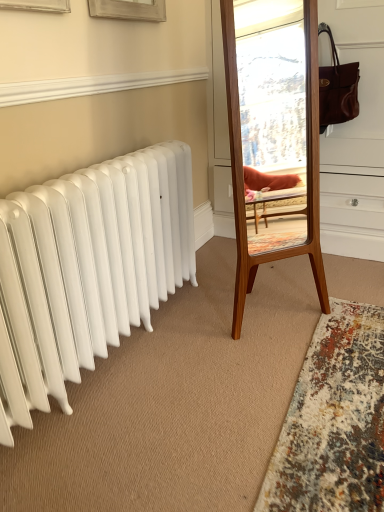
This screenshot has height=512, width=384. What do you see at coordinates (333, 420) in the screenshot?
I see `multicolored shaggy rug at lower right` at bounding box center [333, 420].

The height and width of the screenshot is (512, 384). I want to click on wooden mirror at center, so click(242, 168).

Is multicolored shaggy rug at lower right inside white smooth baseboard at upper center?

That's incorrect, multicolored shaggy rug at lower right is not inside white smooth baseboard at upper center.

Between white smooth baseboard at upper center and multicolored shaggy rug at lower right, which one has larger width?

multicolored shaggy rug at lower right.

Is white smooth baseboard at upper center turned away from multicolored shaggy rug at lower right?

white smooth baseboard at upper center is not turned away from multicolored shaggy rug at lower right.

Which object is further away from the camera, white smooth baseboard at upper center or multicolored shaggy rug at lower right?

white smooth baseboard at upper center.

Is wooden mirror at center closer to camera compared to white smooth baseboard at upper center?

No, wooden mirror at center is further to the viewer.

Which object is thinner, wooden mirror at center or white smooth baseboard at upper center?

With smaller width is white smooth baseboard at upper center.

Is wooden mirror at center touching white smooth baseboard at upper center?

No.

Could white smooth baseboard at upper center be considered to be inside wooden mirror at center?

No, white smooth baseboard at upper center is not inside wooden mirror at center.

Does multicolored shaggy rug at lower right have a greater height compared to wooden mirror at center?

In fact, multicolored shaggy rug at lower right may be shorter than wooden mirror at center.

From the image's perspective, is multicolored shaggy rug at lower right above wooden mirror at center?

No, from the image's perspective, multicolored shaggy rug at lower right is not above wooden mirror at center.

Is multicolored shaggy rug at lower right positioned far away from wooden mirror at center?

multicolored shaggy rug at lower right is actually quite close to wooden mirror at center.

Considering the relative sizes of multicolored shaggy rug at lower right and wooden mirror at center in the image provided, is multicolored shaggy rug at lower right smaller than wooden mirror at center?

Indeed, multicolored shaggy rug at lower right has a smaller size compared to wooden mirror at center.

In the image, is wooden mirror at center positioned in front of or behind multicolored shaggy rug at lower right?

wooden mirror at center is positioned farther from the viewer than multicolored shaggy rug at lower right.

Considering the points (225, 66) and (310, 485), which point is behind, point (225, 66) or point (310, 485)?

Positioned behind is point (225, 66).

Looking at this image, between multicolored shaggy rug at lower right and white smooth baseboard at upper center, which one is positioned behind?

white smooth baseboard at upper center is further away from the camera.

Could you tell me if multicolored shaggy rug at lower right is turned towards white smooth baseboard at upper center?

No, multicolored shaggy rug at lower right is not turned towards white smooth baseboard at upper center.

Would you say multicolored shaggy rug at lower right contains white smooth baseboard at upper center?

Actually, white smooth baseboard at upper center is outside multicolored shaggy rug at lower right.

Would you say multicolored shaggy rug at lower right is to the left or to the right of white smooth baseboard at upper center in the picture?

Based on their positions, multicolored shaggy rug at lower right is located to the right of white smooth baseboard at upper center.

Is white smooth baseboard at upper center positioned far away from wooden mirror at center?

Actually, white smooth baseboard at upper center and wooden mirror at center are a little close together.

Based on the photo, can you confirm if white smooth baseboard at upper center is smaller than wooden mirror at center?

Indeed, white smooth baseboard at upper center has a smaller size compared to wooden mirror at center.

In the scene shown: From the image's perspective, is white smooth baseboard at upper center below wooden mirror at center?

Incorrect, from the image's perspective, white smooth baseboard at upper center is higher than wooden mirror at center.

Which of these two, white smooth baseboard at upper center or wooden mirror at center, stands taller?

Standing taller between the two is wooden mirror at center.

In order to click on window sill located above the multicolored shaggy rug at lower right (from a real-world perspective) in this screenshot , I will do `click(92, 85)`.

The height and width of the screenshot is (512, 384). I want to click on window sill that is on the left side of wooden mirror at center, so click(x=92, y=85).

Based on their spatial positions, is multicolored shaggy rug at lower right or wooden mirror at center further from white smooth baseboard at upper center?

Based on the image, multicolored shaggy rug at lower right appears to be further to white smooth baseboard at upper center.

Which object lies nearer to the anchor point multicolored shaggy rug at lower right, wooden mirror at center or white smooth baseboard at upper center?

Based on the image, wooden mirror at center appears to be nearer to multicolored shaggy rug at lower right.

Estimate the real-world distances between objects in this image. Which object is further from wooden mirror at center, multicolored shaggy rug at lower right or white smooth baseboard at upper center?

white smooth baseboard at upper center lies further to wooden mirror at center than the other object.

Estimate the real-world distances between objects in this image. Which object is closer to multicolored shaggy rug at lower right, white smooth baseboard at upper center or wooden mirror at center?

wooden mirror at center lies closer to multicolored shaggy rug at lower right than the other object.

Estimate the real-world distances between objects in this image. Which object is further from wooden mirror at center, white smooth baseboard at upper center or multicolored shaggy rug at lower right?

white smooth baseboard at upper center.

Looking at the image, which one is located further to white smooth baseboard at upper center, wooden mirror at center or multicolored shaggy rug at lower right?

multicolored shaggy rug at lower right lies further to white smooth baseboard at upper center than the other object.

Where is `mirror between white smooth baseboard at upper center and multicolored shaggy rug at lower right vertically`? The height and width of the screenshot is (512, 384). mirror between white smooth baseboard at upper center and multicolored shaggy rug at lower right vertically is located at coordinates (242, 168).